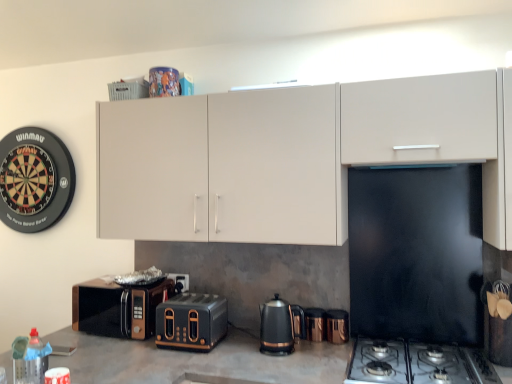
Question: Considering the relative sizes of matte white cabinet at upper center and black metallic gas stove at lower right in the image provided, is matte white cabinet at upper center shorter than black metallic gas stove at lower right?

Choices:
 (A) no
 (B) yes

Answer: (A)

Question: Does matte white cabinet at upper center come in front of black metallic gas stove at lower right?

Choices:
 (A) no
 (B) yes

Answer: (A)

Question: Is matte white cabinet at upper center smaller than black metallic gas stove at lower right?

Choices:
 (A) yes
 (B) no

Answer: (B)

Question: Can we say matte white cabinet at upper center lies outside black metallic gas stove at lower right?

Choices:
 (A) no
 (B) yes

Answer: (B)

Question: Is matte white cabinet at upper center facing away from black metallic gas stove at lower right?

Choices:
 (A) yes
 (B) no

Answer: (B)

Question: Based on their positions, is black metallic gas stove at lower right located to the left or right of bronze metallic microwave at lower left?

Choices:
 (A) left
 (B) right

Answer: (B)

Question: Is black metallic gas stove at lower right situated inside bronze metallic microwave at lower left or outside?

Choices:
 (A) outside
 (B) inside

Answer: (A)

Question: From the image's perspective, is black metallic gas stove at lower right located above or below bronze metallic microwave at lower left?

Choices:
 (A) above
 (B) below

Answer: (B)

Question: From their relative heights in the image, would you say black metallic gas stove at lower right is taller or shorter than bronze metallic microwave at lower left?

Choices:
 (A) tall
 (B) short

Answer: (B)

Question: Is black metallic gas stove at lower right bigger or smaller than copper metallic kettle at center, acting as the first appliance starting from the right?

Choices:
 (A) big
 (B) small

Answer: (A)

Question: Considering the positions of black metallic gas stove at lower right and copper metallic kettle at center, marked as the 2th appliance in a left-to-right arrangement, in the image, is black metallic gas stove at lower right taller or shorter than copper metallic kettle at center, marked as the 2th appliance in a left-to-right arrangement,?

Choices:
 (A) tall
 (B) short

Answer: (B)

Question: Is black metallic gas stove at lower right to the left or to the right of copper metallic kettle at center, acting as the first appliance starting from the right, in the image?

Choices:
 (A) right
 (B) left

Answer: (A)

Question: From a real-world perspective, is black metallic gas stove at lower right above or below copper metallic kettle at center, acting as the first appliance starting from the right?

Choices:
 (A) below
 (B) above

Answer: (A)

Question: Is copper metallic kettle at center, marked as the 2th appliance in a left-to-right arrangement, wider or thinner than black metallic toaster at center?

Choices:
 (A) wide
 (B) thin

Answer: (B)

Question: Looking at the image, does copper metallic kettle at center, marked as the 2th appliance in a left-to-right arrangement, seem bigger or smaller compared to black metallic toaster at center?

Choices:
 (A) small
 (B) big

Answer: (A)